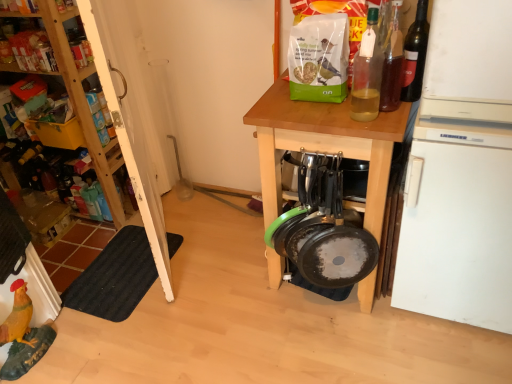
Locate an element on the screen. free point to the right of black rubber mat at lower left is located at coordinates (208, 274).